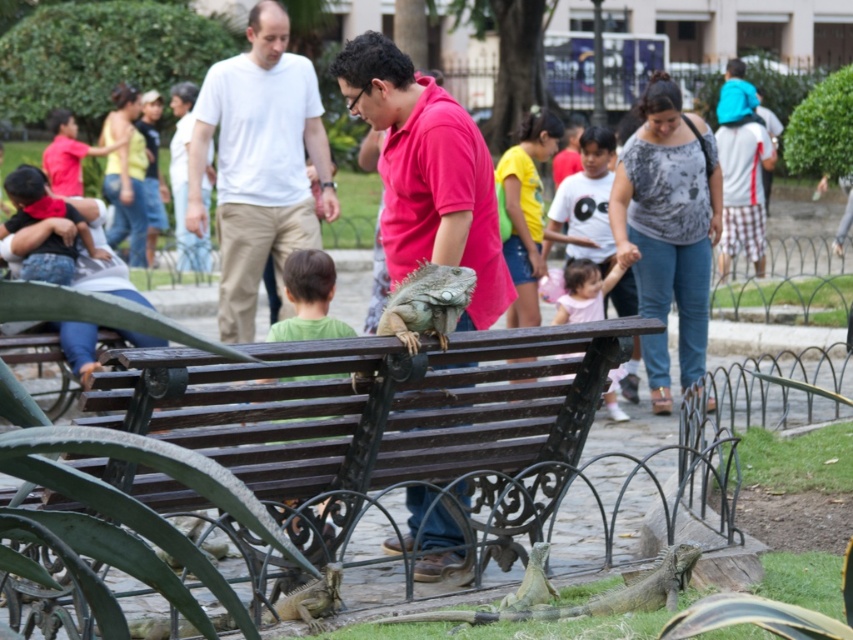
You are a photographer trying to capture a group photo of the people at the park. You notice the white cotton shirt at center and the pink fabric dress at center. Which clothing item should you focus on first to ensure it fits properly within the frame?

The white cotton shirt at center has a larger size compared to the pink fabric dress at center, so you should focus on positioning the white cotton shirt at center first to ensure it fits within the frame.

You are standing in the park and see both the white cotton shirt at center and the pink fabric dress at center. Which one is closer to you?

The white cotton shirt at center is closer to you because it is further to the viewer than the pink fabric dress at center.

You are standing at the origin point in the image and want to locate the white cotton shirt at center. Which direction should you move to find it?

The white cotton shirt at center is located at coordinates point (258,163), so you should move northeast to reach it.